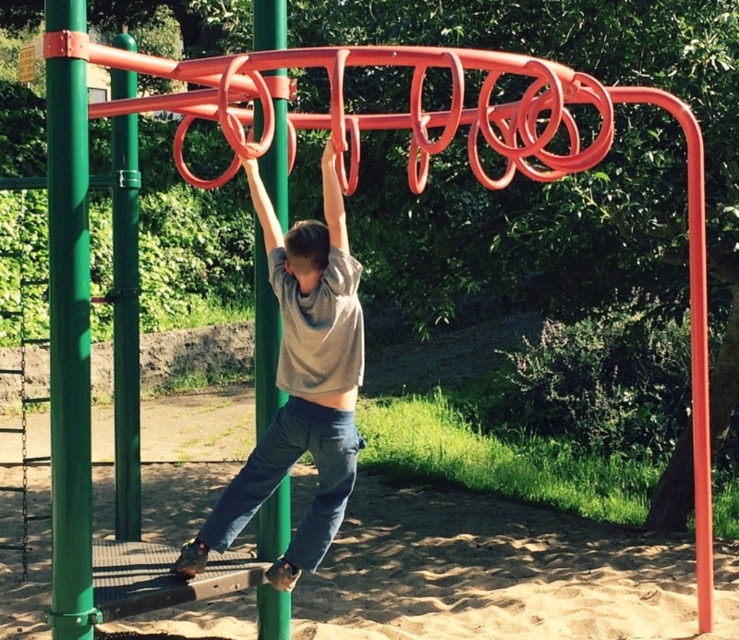
You are standing at the point labeled as point (517, 538) in the playground. You want to take a photo of the monkey bars from a distance of 30 feet. Can you move closer to the monkey bars to achieve this? Please explain your reasoning.

The distance between point (517, 538) and the camera is currently 34.24 feet. To take a photo from 30 feet away, you need to move 4.24 feet closer to the monkey bars.

You are a parent observing your child at the playground. You notice the gray cotton shirt at center and the sandy brown at lower center. Which object is closer to the ground?

The sandy brown at lower center is closer to the ground because it is shorter than the gray cotton shirt at center.

You are a photographer trying to capture a photo of the gray cotton shirt at center and the green matte pole at left. Which object should you focus on first if you want to ensure both are in sharp focus?

The gray cotton shirt at center is shorter than the green matte pole at left, so you should focus on the green matte pole at left first to ensure both are in sharp focus.